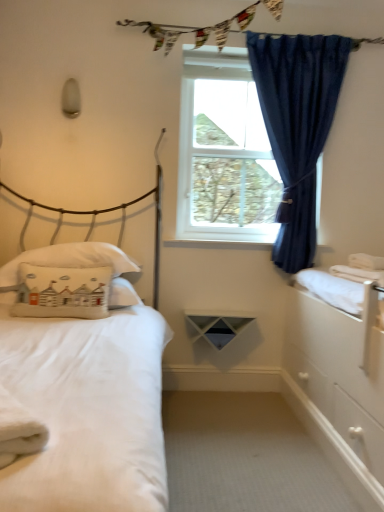
Question: Is white cotton pillow at left, which is counted as the first pillow, starting from the back, taller or shorter than white matte bed at left?

Choices:
 (A) short
 (B) tall

Answer: (A)

Question: In terms of width, does white cotton pillow at left, marked as the 2th pillow in a front-to-back arrangement, look wider or thinner when compared to white matte bed at left?

Choices:
 (A) thin
 (B) wide

Answer: (A)

Question: Based on their relative distances, which object is farther from the white cotton pillow at left, placed as the second pillow when sorted from back to front?

Choices:
 (A) white glossy dresser at right
 (B) blue velvet curtain at upper right
 (C) white plastic window at center
 (D) white cotton pillow at left, marked as the 2th pillow in a front-to-back arrangement
 (E) white matte bed at left

Answer: (B)

Question: Which object is positioned farthest from the white plastic window at center?

Choices:
 (A) blue velvet curtain at upper right
 (B) white glossy dresser at right
 (C) textured fabric clothesline at upper center
 (D) white cotton pillow at left, acting as the first pillow starting from the front
 (E) white matte bed at left

Answer: (E)